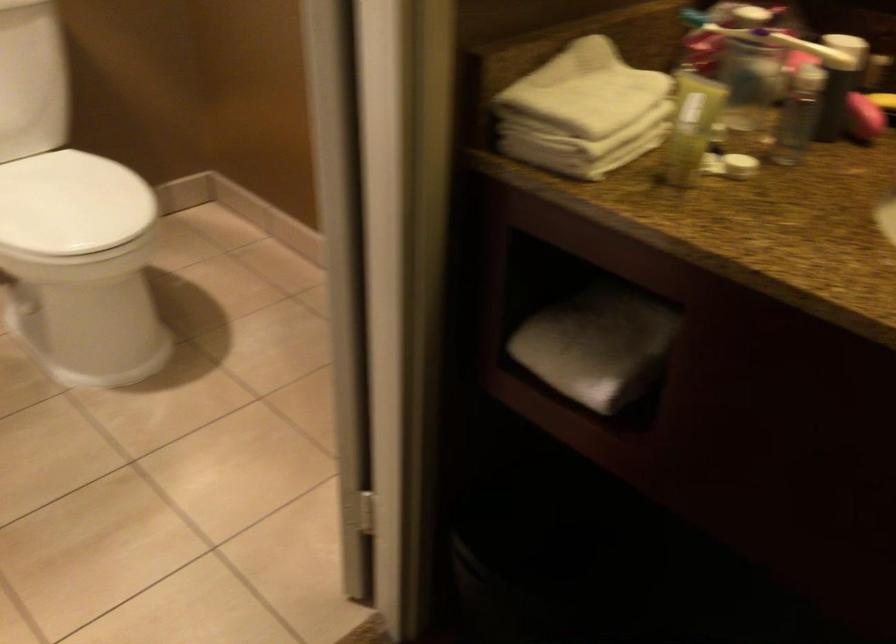
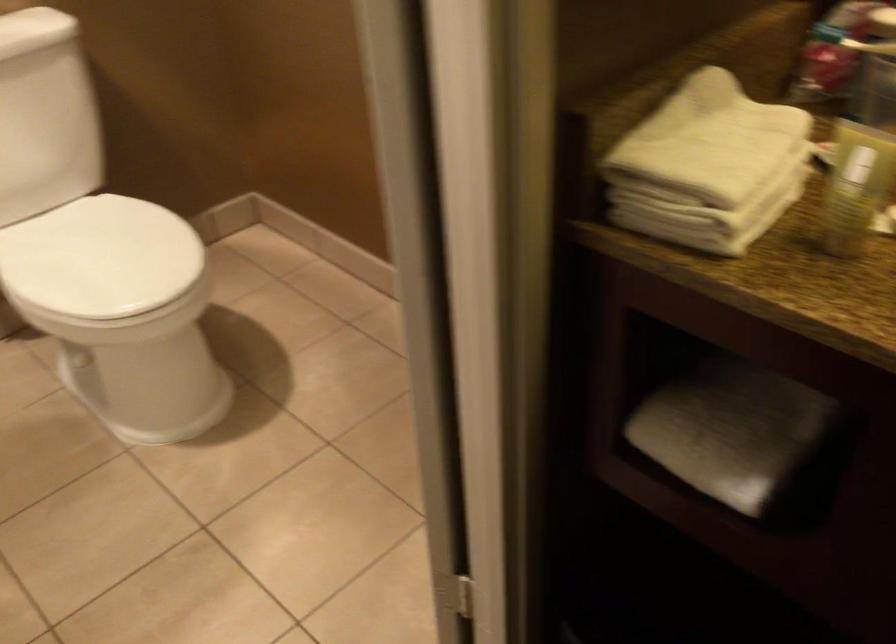
Find the pixel in the second image that matches point 592,344 in the first image.

(730, 431)